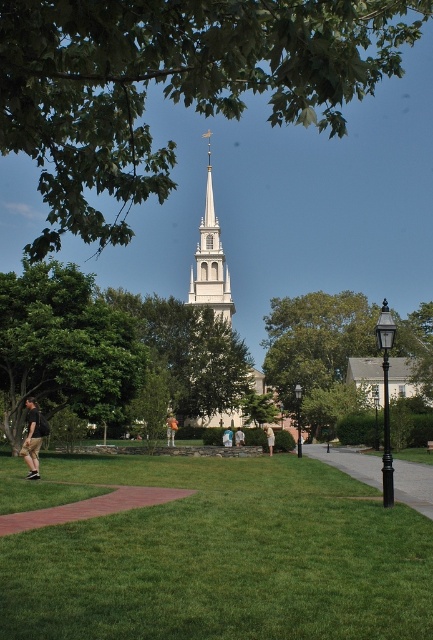
Is point (239, 541) more distant than point (313, 385)?

No, it is in front of (313, 385).

Which is more to the left, green grass at lower center or green leafy tree at center?

From the viewer's perspective, green grass at lower center appears more on the left side.

Which is behind, point (145, 596) or point (359, 332)?

The point (359, 332) is behind.

Where is `green grass at lower center`? This screenshot has height=640, width=433. green grass at lower center is located at coordinates (222, 557).

Between green grass at lower center and white cotton shirt at center, which one appears on the right side from the viewer's perspective?

Positioned to the right is white cotton shirt at center.

Between point (384, 614) and point (268, 422), which one is positioned behind?

Point (268, 422)

Does point (70, 586) come farther from viewer compared to point (264, 426)?

No, (70, 586) is in front of (264, 426).

Where is `green grass at lower center`? The height and width of the screenshot is (640, 433). green grass at lower center is located at coordinates (222, 557).

Who is positioned more to the left, green leafy tree at left or light blue fabric shirt at center?

From the viewer's perspective, green leafy tree at left appears more on the left side.

Consider the image. Is green leafy tree at left positioned in front of light blue fabric shirt at center?

Yes, green leafy tree at left is in front of light blue fabric shirt at center.

Which is behind, point (73, 296) or point (244, 444)?

The point (244, 444) is more distant.

Where is `green leafy tree at left`? green leafy tree at left is located at coordinates (64, 348).